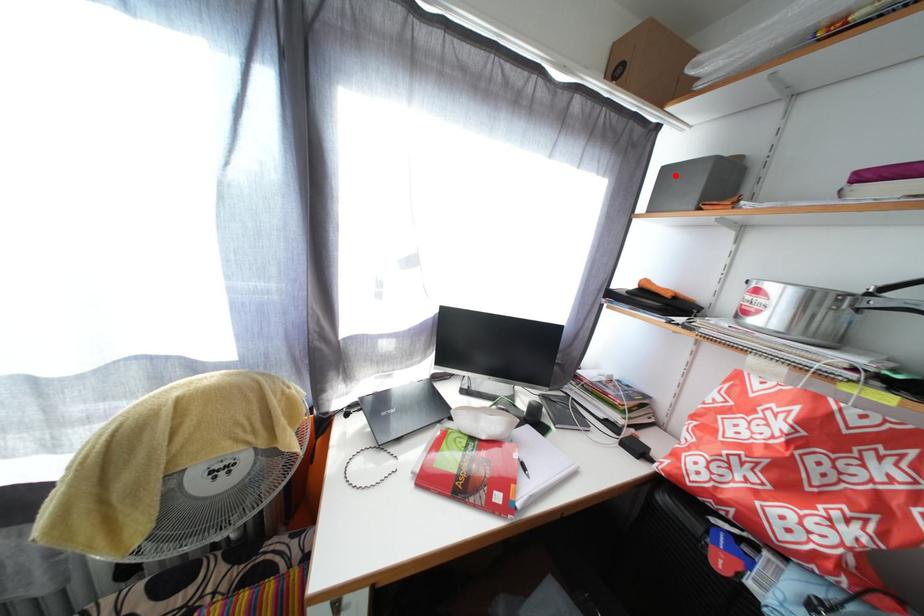
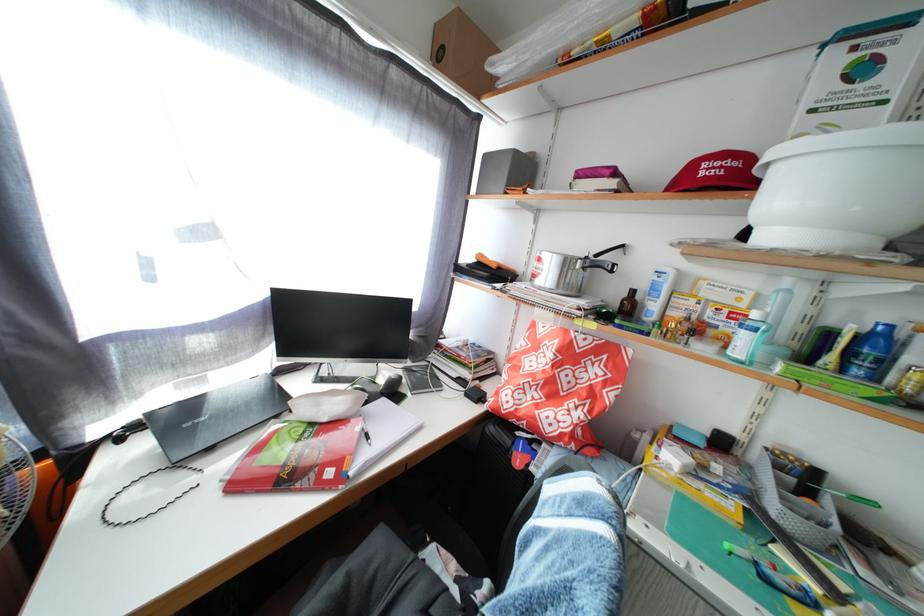
Where in the second image is the point corresponding to the highlighted location from the first image?

(494, 163)